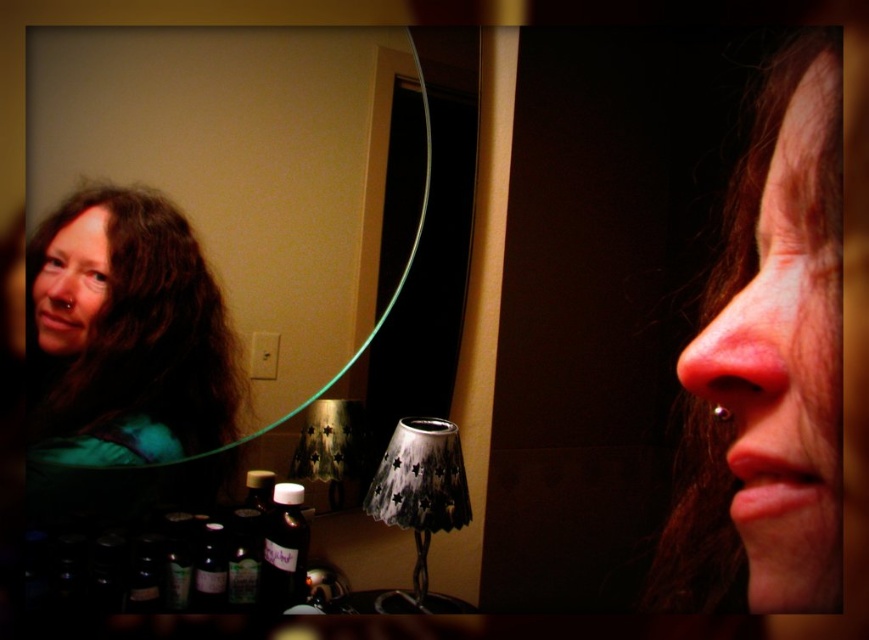
In the scene shown: Is clear glass mirror at upper center bigger than pink skin at center?

No, clear glass mirror at upper center is not bigger than pink skin at center.

Can you confirm if clear glass mirror at upper center is positioned to the left of pink skin at center?

Correct, you'll find clear glass mirror at upper center to the left of pink skin at center.

Is point (216, 336) positioned in front of point (797, 522)?

No, (216, 336) is behind (797, 522).

The height and width of the screenshot is (640, 869). What are the coordinates of `clear glass mirror at upper center` in the screenshot? It's located at (198, 228).

Which is in front, point (123, 243) or point (58, 353)?

Point (58, 353) is in front.

Does dark brown silky hair at left have a greater width compared to matte black face at upper left?

Correct, the width of dark brown silky hair at left exceeds that of matte black face at upper left.

Does point (217, 305) come in front of point (91, 264)?

No, (217, 305) is further to viewer.

Identify the location of dark brown silky hair at left. (128, 333).

Does clear glass mirror at upper center have a larger size compared to matte black face at upper left?

Yes, clear glass mirror at upper center is bigger than matte black face at upper left.

Is clear glass mirror at upper center to the right of matte black face at upper left from the viewer's perspective?

Indeed, clear glass mirror at upper center is positioned on the right side of matte black face at upper left.

Does point (253, 266) lie behind point (90, 260)?

That is True.

Identify the location of clear glass mirror at upper center. (198, 228).